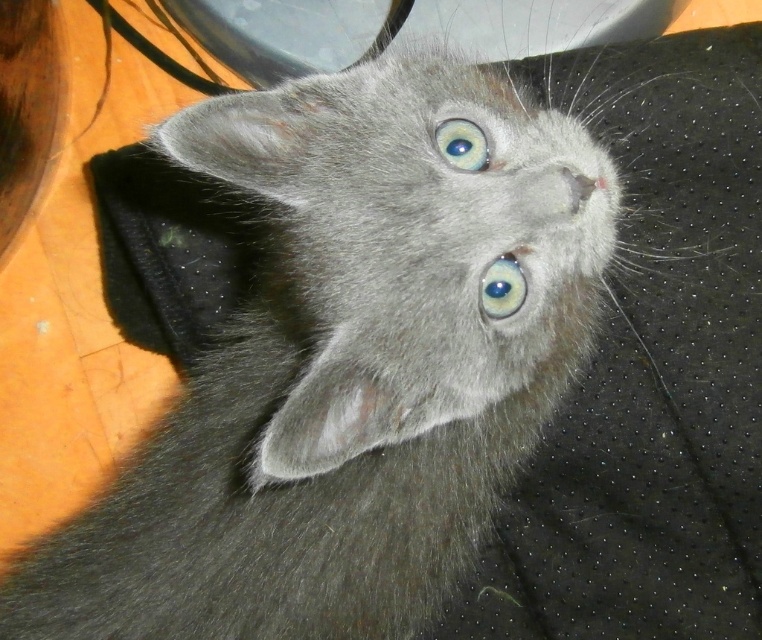
Which is more to the left, blue glossy eye at center or blue glossy eye at upper center?

blue glossy eye at upper center is more to the left.

Is blue glossy eye at center taller than blue glossy eye at upper center?

Correct, blue glossy eye at center is much taller as blue glossy eye at upper center.

This screenshot has width=762, height=640. In order to click on blue glossy eye at center in this screenshot , I will do `click(501, 288)`.

What are the coordinates of `blue glossy eye at center` in the screenshot? It's located at (501, 288).